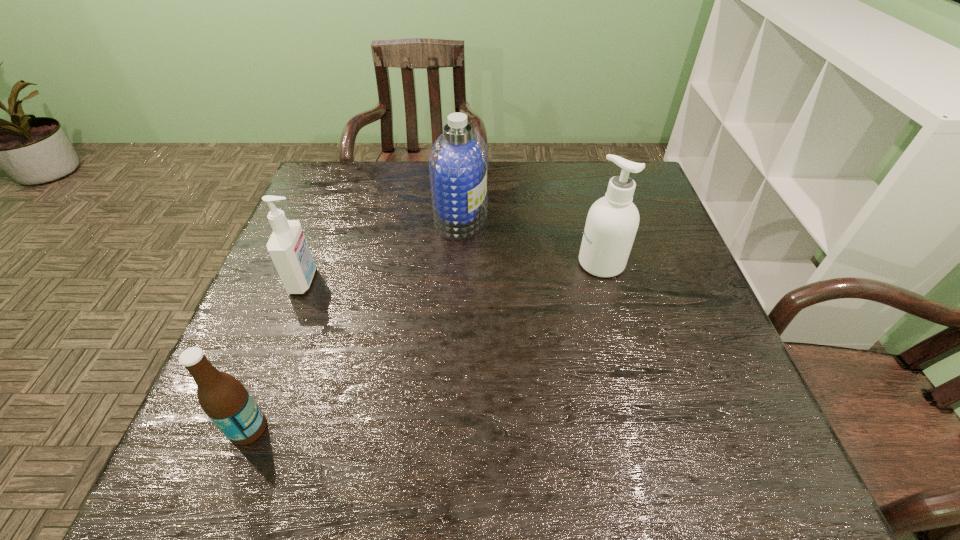
Image resolution: width=960 pixels, height=540 pixels. I want to click on vacant point located between the farthest object and the beer bottle, so click(x=355, y=323).

At what (x,y) coordinates should I click in order to perform the action: click on free space that is in between the rightmost cleansing agent and the leftmost cleansing agent. Please return your answer as a coordinate pair (x, y). This screenshot has height=540, width=960. Looking at the image, I should click on (452, 272).

Where is `vacant area between the rightmost object and the second object from right to left`? The image size is (960, 540). vacant area between the rightmost object and the second object from right to left is located at coordinates (531, 241).

The height and width of the screenshot is (540, 960). Find the location of `object identified as the third closest to the rightmost cleansing agent`. object identified as the third closest to the rightmost cleansing agent is located at coordinates (224, 399).

Where is `object that is the third closest to the leftmost cleansing agent`? The width and height of the screenshot is (960, 540). object that is the third closest to the leftmost cleansing agent is located at coordinates (612, 222).

Identify which cleansing agent is the closest to the beer bottle. Please provide its 2D coordinates. Your answer should be formatted as a tuple, i.e. [(x, y)], where the tuple contains the x and y coordinates of a point satisfying the conditions above.

[(287, 246)]

Locate an element on the screen. cleansing agent that is the second closest to the nearest object is located at coordinates (458, 163).

This screenshot has width=960, height=540. Identify the location of vacant space that satisfies the following two spatial constraints: 1. on the front label of the leftmost cleansing agent; 2. on the right side of the nearest object. (247, 428).

The image size is (960, 540). I want to click on free space that satisfies the following two spatial constraints: 1. on the front label of the nearest object; 2. on the left side of the shortest cleansing agent, so click(x=247, y=428).

Where is `vacant point that satisfies the following two spatial constraints: 1. on the back side of the beer bottle; 2. on the front label of the shortest cleansing agent`? vacant point that satisfies the following two spatial constraints: 1. on the back side of the beer bottle; 2. on the front label of the shortest cleansing agent is located at coordinates (304, 280).